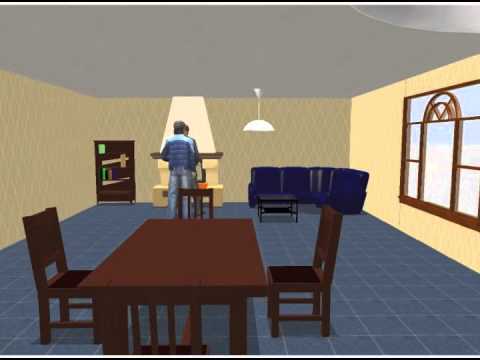
Locate an element on the screen. This screenshot has width=480, height=360. frame is located at coordinates (452, 180).